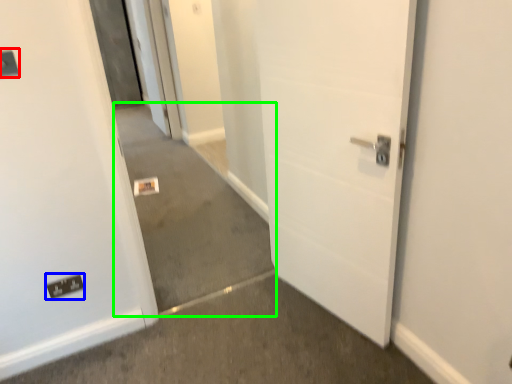
Question: Based on their relative distances, which object is farther from light switch (highlighted by a red box)? Choose from electric outlet (highlighted by a blue box) and concrete (highlighted by a green box).

Choices:
 (A) electric outlet
 (B) concrete

Answer: (B)